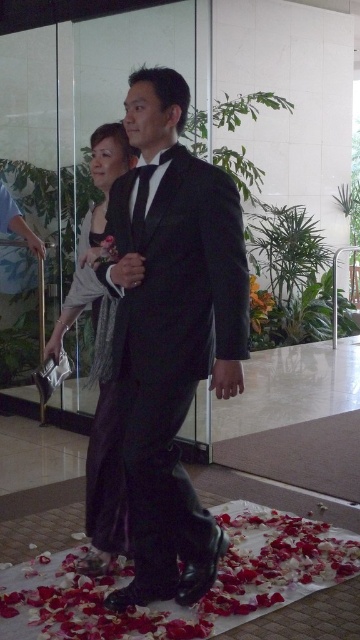
Does satin silver dress at center have a greater width compared to orange matte flower at center?

Incorrect, satin silver dress at center's width does not surpass orange matte flower at center's.

Does satin silver dress at center appear over orange matte flower at center?

No, satin silver dress at center is not above orange matte flower at center.

Does point (77, 291) come behind point (264, 320)?

No, it is not.

This screenshot has width=360, height=640. Find the location of `satin silver dress at center`. satin silver dress at center is located at coordinates (92, 305).

Looking at this image, does black satin suit at center have a lesser width compared to orange matte flower at center?

No, black satin suit at center is not thinner than orange matte flower at center.

Who is shorter, black satin suit at center or orange matte flower at center?

orange matte flower at center is shorter.

Measure the distance between black satin suit at center and camera.

The distance of black satin suit at center from camera is 6.00 feet.

Find the location of a particular element. This screenshot has height=640, width=360. black satin suit at center is located at coordinates (171, 332).

Between satin black dress at center and satin silver dress at center, which one has more height?

Standing taller between the two is satin black dress at center.

Is point (97, 280) behind point (104, 339)?

No, it is in front of (104, 339).

Find the location of a particular element. Image resolution: width=360 pixels, height=640 pixels. satin black dress at center is located at coordinates (100, 356).